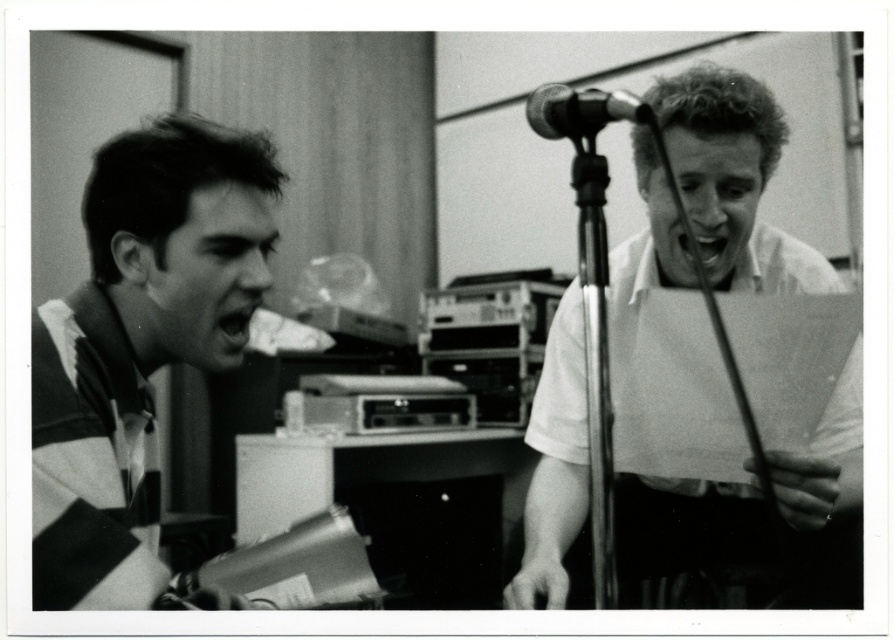
You are a photographer in a studio. You need to decide which object, the striped jersey at left or the white paper at right, can be fully captured in a closeup shot without cropping. Which one should you choose?

The striped jersey at left has a smaller size compared to white paper at right, so you should choose the striped jersey at left for the closeup shot to ensure it fits without cropping.

You are standing at point (776, 288) in the studio. You need to walk to the microphone stand which is 5.50 feet away from you. Can you reach it without moving any furniture?

Yes, you can reach the microphone stand without moving any furniture since it is only 5.50 feet away from your current position at point (776, 288).